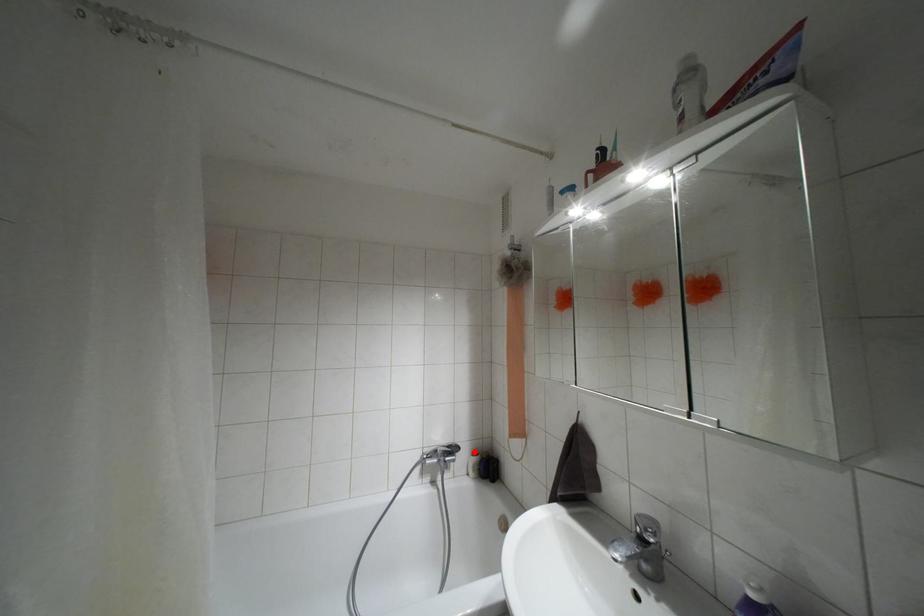
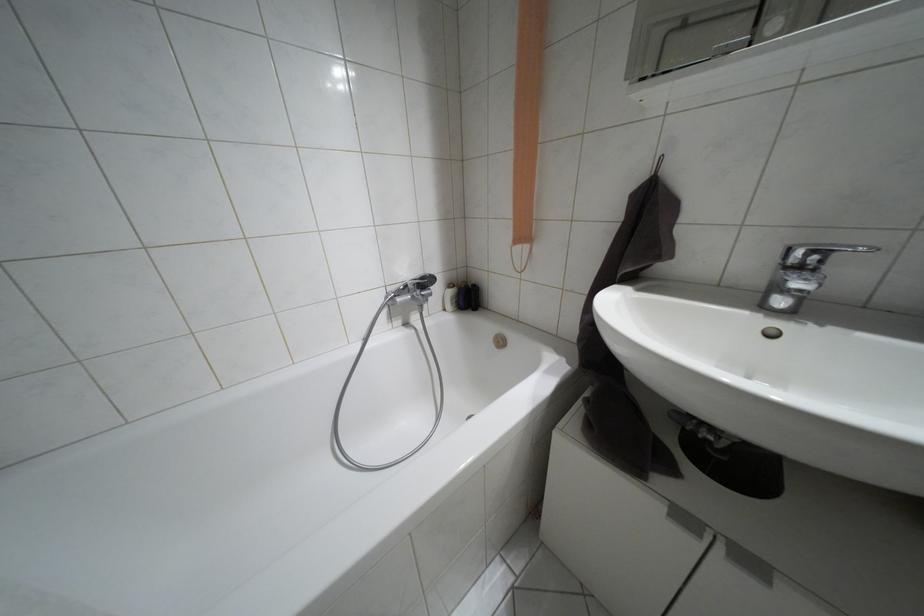
Question: I am providing you with two images of the same scene from different viewpoints. A red point is shown in image1. For the corresponding object point in image2, is it positioned nearer or farther from the camera?

Choices:
 (A) Nearer
 (B) Farther

Answer: (A)